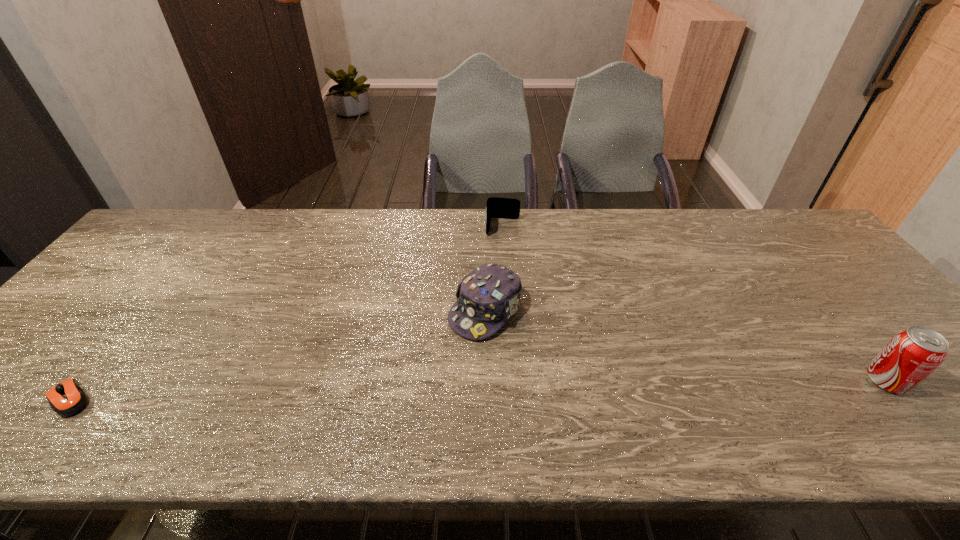
Find the location of a particular element. The width and height of the screenshot is (960, 540). vacant area that satisfies the following two spatial constraints: 1. on the front side of the second farthest object; 2. on the right side of the tallest object is located at coordinates (486, 381).